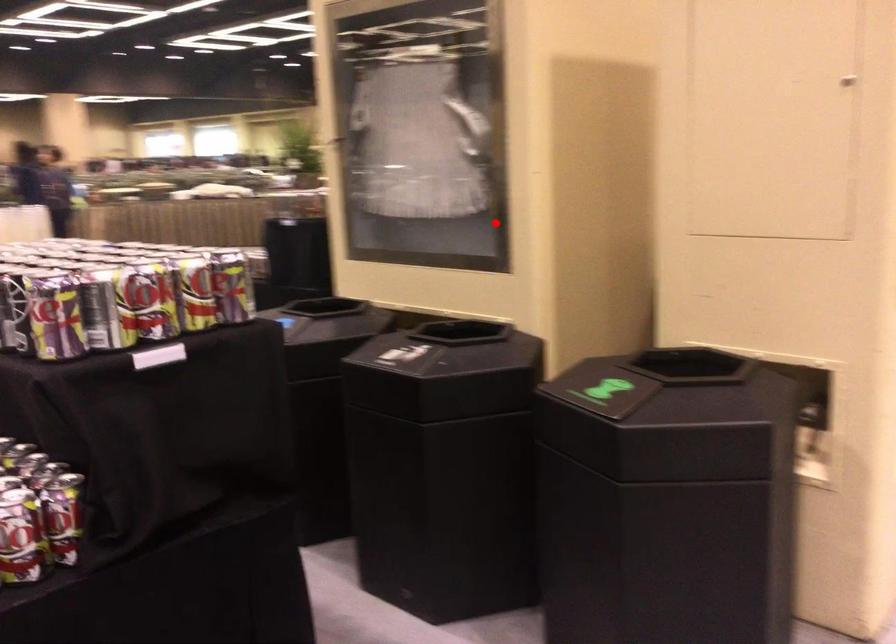
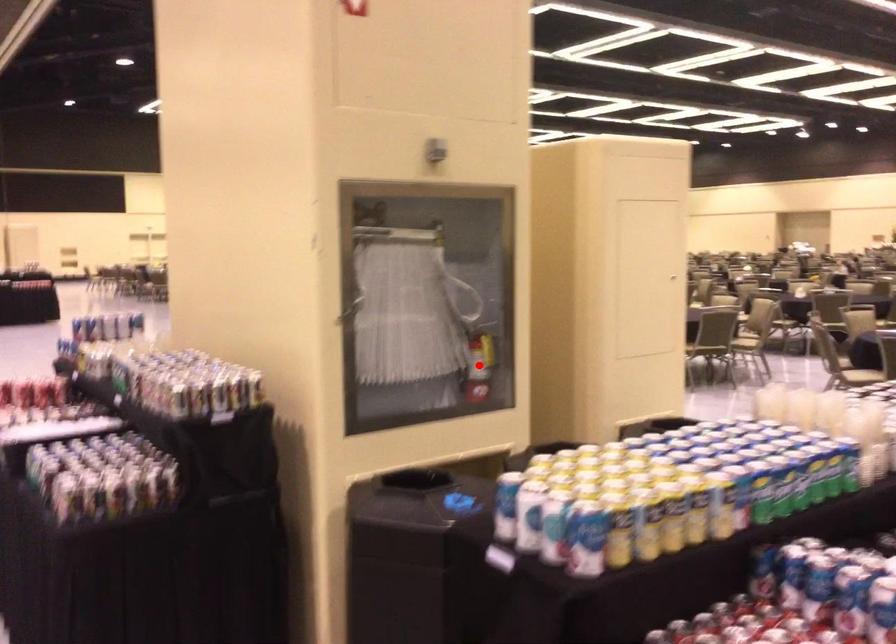
I am providing you with two images of the same scene from different viewpoints. A red point is marked on the first image and another point is marked on the second image. Do the highlighted points in image1 and image2 indicate the same real-world spot?

Yes